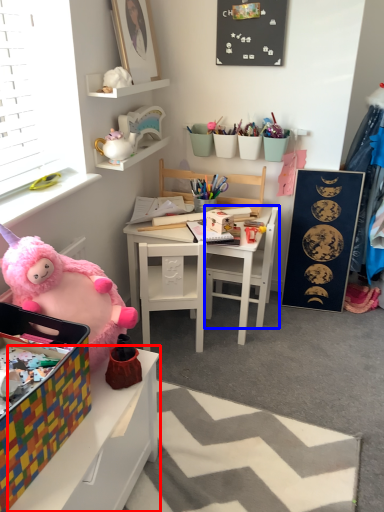
Question: Which object appears closest to the camera in this image, table (highlighted by a red box) or chair (highlighted by a blue box)?

Choices:
 (A) table
 (B) chair

Answer: (A)